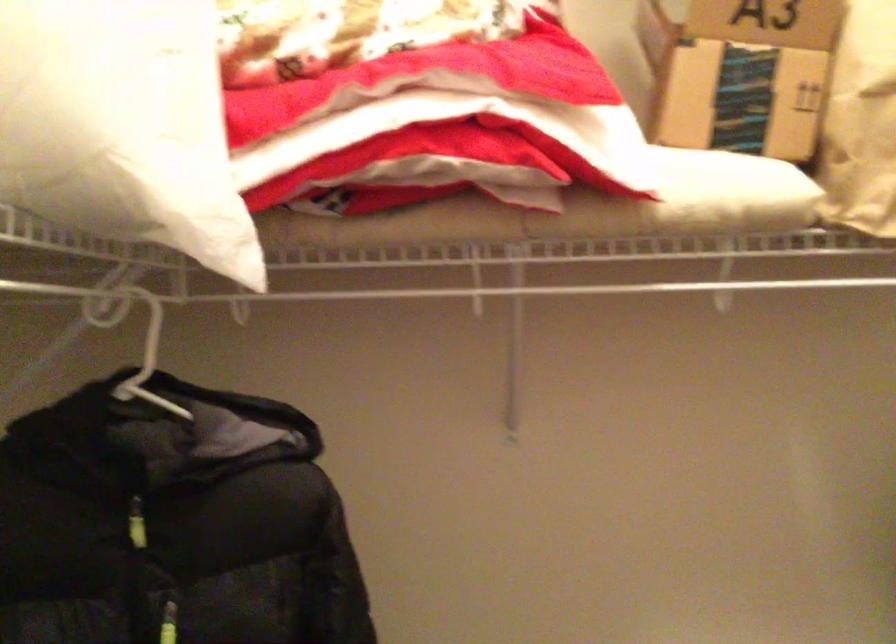
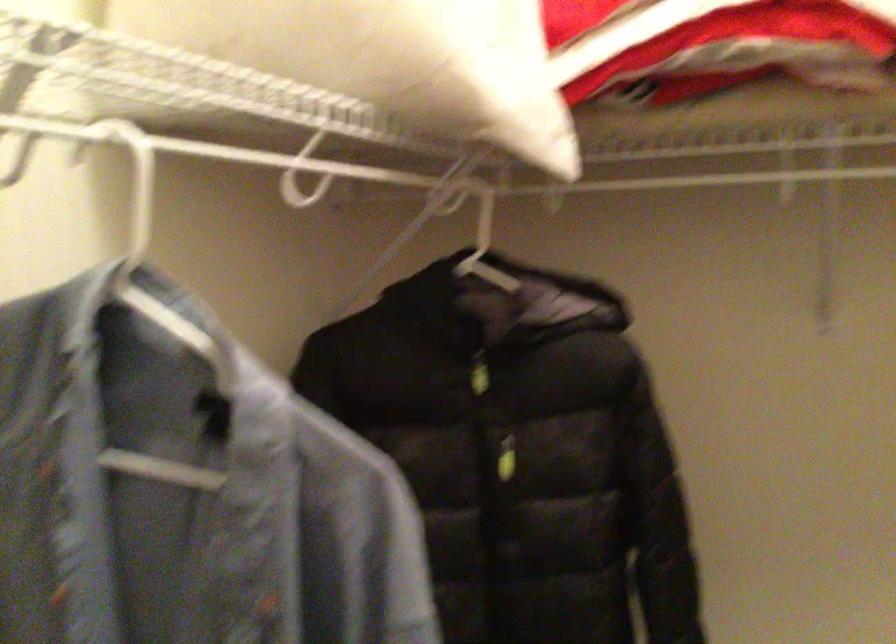
Question: The first image is from the beginning of the video and the second image is from the end. How did the camera likely rotate when shooting the video?

Choices:
 (A) Left
 (B) Right
 (C) Up
 (D) Down

Answer: (A)